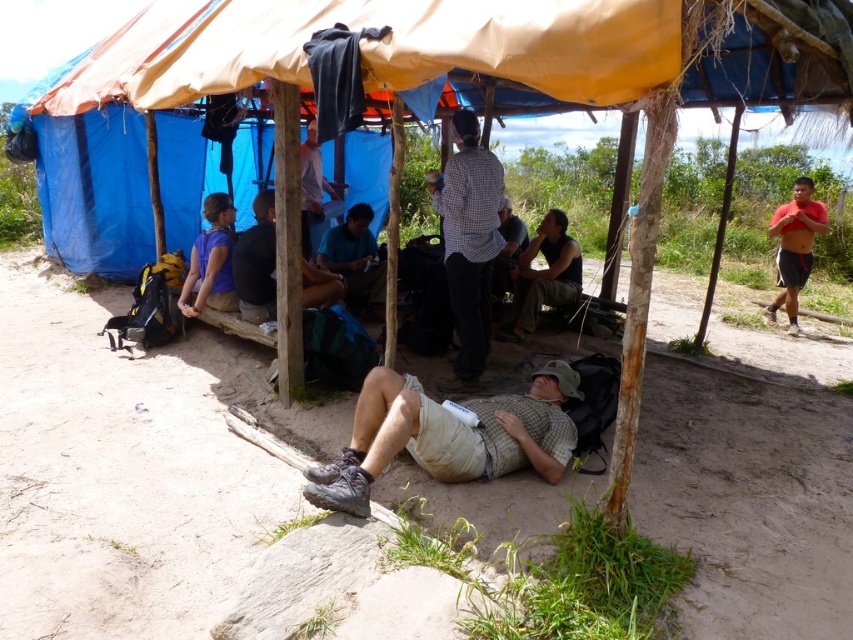
Question: Can you confirm if checkered fabric shirt at center is smaller than dark brown leather jacket at center?

Choices:
 (A) yes
 (B) no

Answer: (B)

Question: Considering the real-world distances, which object is farthest from the purple fabric shirt at left?

Choices:
 (A) dark brown leather jacket at center
 (B) dark green fabric shirt at center
 (C) checkered fabric shirt at center

Answer: (C)

Question: Among these objects, which one is farthest from the camera?

Choices:
 (A) purple fabric shirt at left
 (B) orange shirtless man at right
 (C) tan canvas sleeping bag at lower center
 (D) black fabric shirt at center

Answer: (B)

Question: Can you confirm if checkered fabric shirt at center is positioned above dark green fabric shirt at center?

Choices:
 (A) no
 (B) yes

Answer: (A)

Question: Which point is closer to the camera?

Choices:
 (A) orange shirtless man at right
 (B) dark green fabric shirt at center

Answer: (B)

Question: Is tan canvas sleeping bag at lower center below black fabric shirt at center?

Choices:
 (A) yes
 (B) no

Answer: (A)